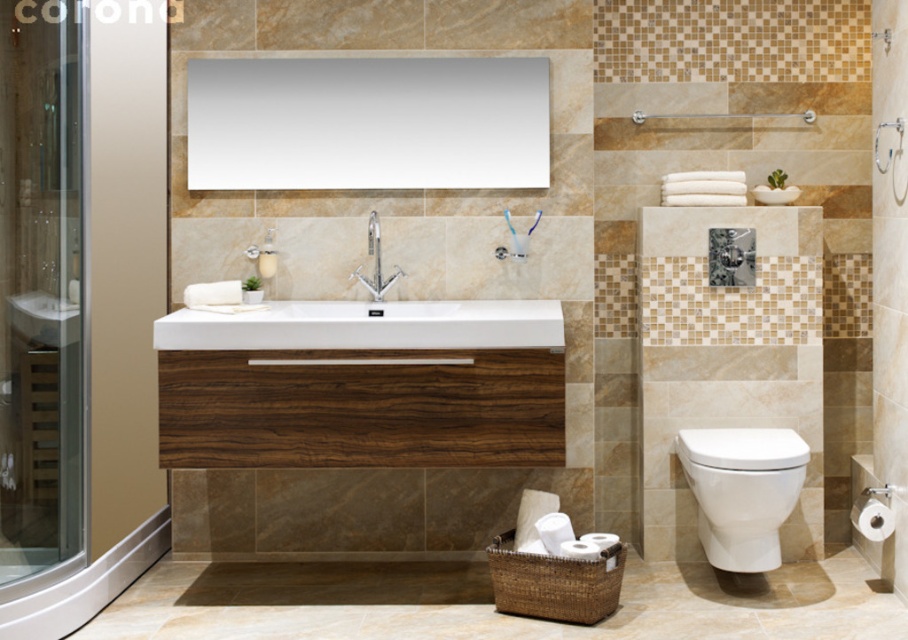
Question: Which object is positioned closest to the white glossy sink at center?

Choices:
 (A) transparent glass screen door at right
 (B) matte wood shower at upper center
 (C) chrome metallic faucet at center

Answer: (C)

Question: Can you confirm if white glossy sink at center is wider than matte wood shower at upper center?

Choices:
 (A) yes
 (B) no

Answer: (A)

Question: Is white glossy sink at center thinner than white glossy toilet at lower right?

Choices:
 (A) no
 (B) yes

Answer: (A)

Question: Which of the following is the farthest from the observer?

Choices:
 (A) (334, 253)
 (B) (400, 269)

Answer: (A)

Question: Considering the real-world distances, which object is closest to the white glossy toilet at lower right?

Choices:
 (A) transparent glass shower door at left
 (B) chrome metallic faucet at center
 (C) matte wood shower at upper center

Answer: (C)

Question: From the image, what is the correct spatial relationship of transparent glass shower door at left in relation to white glossy toilet at lower right?

Choices:
 (A) left
 (B) right

Answer: (A)